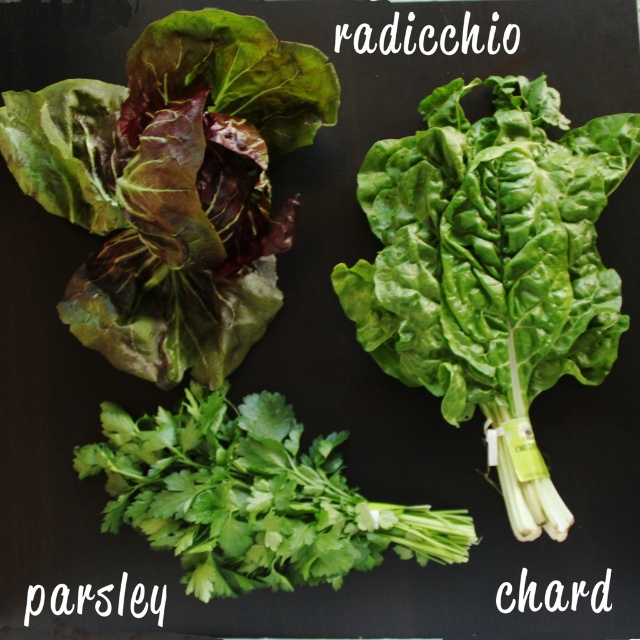
Question: Is green leafy chard at center further to the viewer compared to green leafy parsley at lower center?

Choices:
 (A) yes
 (B) no

Answer: (B)

Question: Does green leafy chard at center appear on the right side of green leafy parsley at lower center?

Choices:
 (A) no
 (B) yes

Answer: (B)

Question: Estimate the real-world distances between objects in this image. Which object is closer to the green leafy chard at center?

Choices:
 (A) green leafy parsley at lower center
 (B) dark green leafy at upper left

Answer: (A)

Question: Does dark green leafy at upper left come in front of green leafy chard at center?

Choices:
 (A) yes
 (B) no

Answer: (A)

Question: Which object is positioned farthest from the green leafy parsley at lower center?

Choices:
 (A) dark green leafy at upper left
 (B) green leafy chard at center

Answer: (B)

Question: Which point is closer to the camera?

Choices:
 (A) (212, 456)
 (B) (150, 76)
 (C) (403, 273)

Answer: (B)